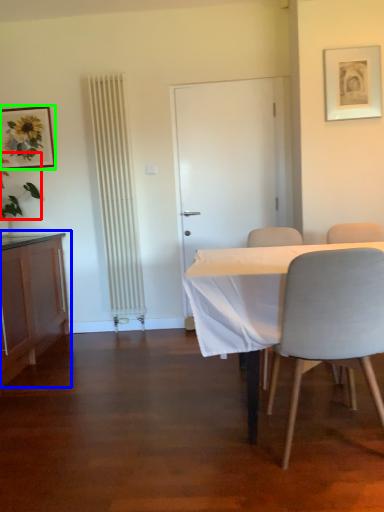
Question: Which object is positioned closest to plant (highlighted by a red box)? Select from cabinetry (highlighted by a blue box) and picture frame (highlighted by a green box).

Choices:
 (A) cabinetry
 (B) picture frame

Answer: (B)